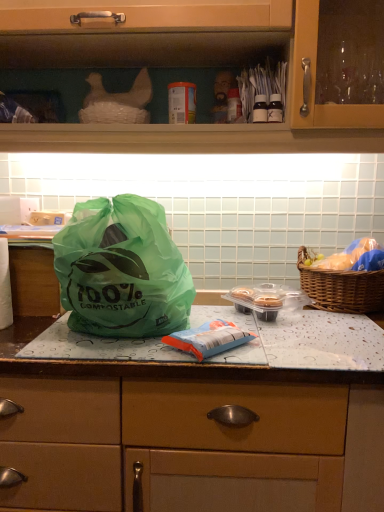
Where is `free region on the left part of blue matte plastic bag at center, acting as the second food starting from the back`? Image resolution: width=384 pixels, height=512 pixels. free region on the left part of blue matte plastic bag at center, acting as the second food starting from the back is located at coordinates (122, 349).